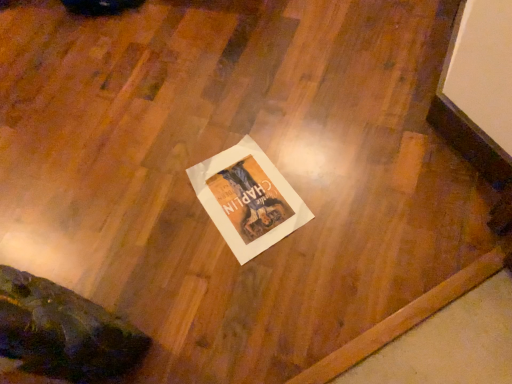
The width and height of the screenshot is (512, 384). Identify the location of vacant area to the right of white paper poster at center. (335, 171).